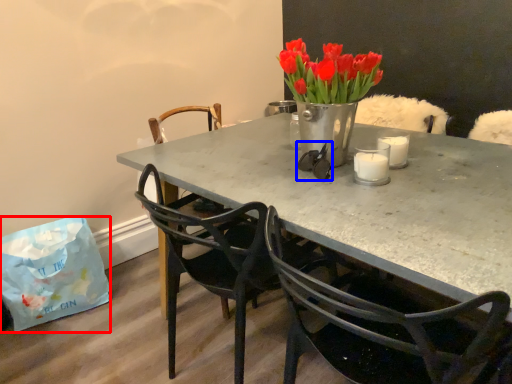
Question: Which object is further to the camera taking this photo, handbag (highlighted by a red box) or glasses (highlighted by a blue box)?

Choices:
 (A) handbag
 (B) glasses

Answer: (A)